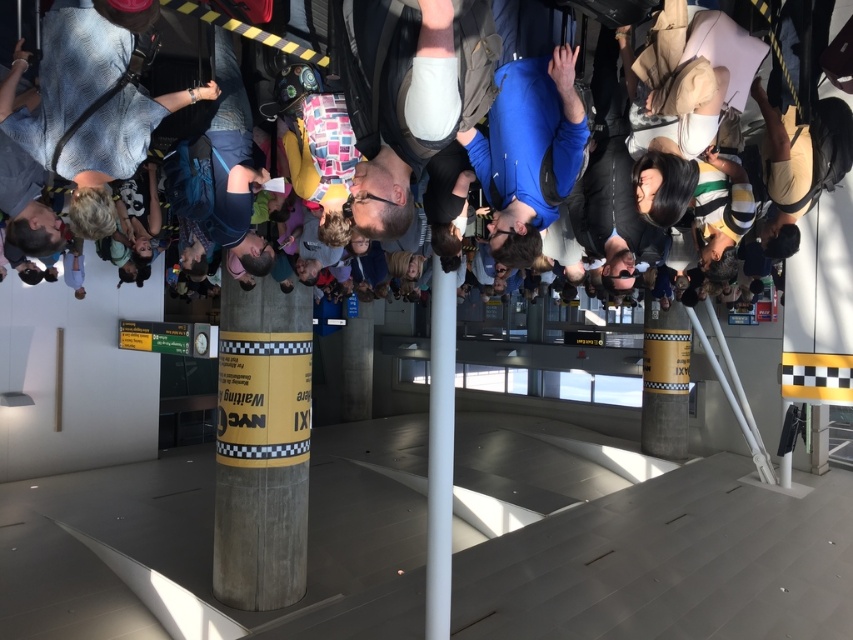
You are a delivery person carrying a box that is 2 meters long. You need to place it between the matte black backpack at upper center and the white smooth pole at center. Is there enough space?

The distance between the matte black backpack at upper center and the white smooth pole at center is 1.90 meters. Since the box is 2 meters long, there is not enough space to place it between them.

In the scene shown: You are a traveler at an airport and see the matte black backpack at upper center and the wooden textured pillar at center. Which object is positioned more to the east side of the scene?

The matte black backpack at upper center is positioned to the right of the wooden textured pillar at center. Since the scene is rotated 90 degrees clockwise, the right side of the image corresponds to the east direction. Therefore, the matte black backpack at upper center is more to the east side of the scene.